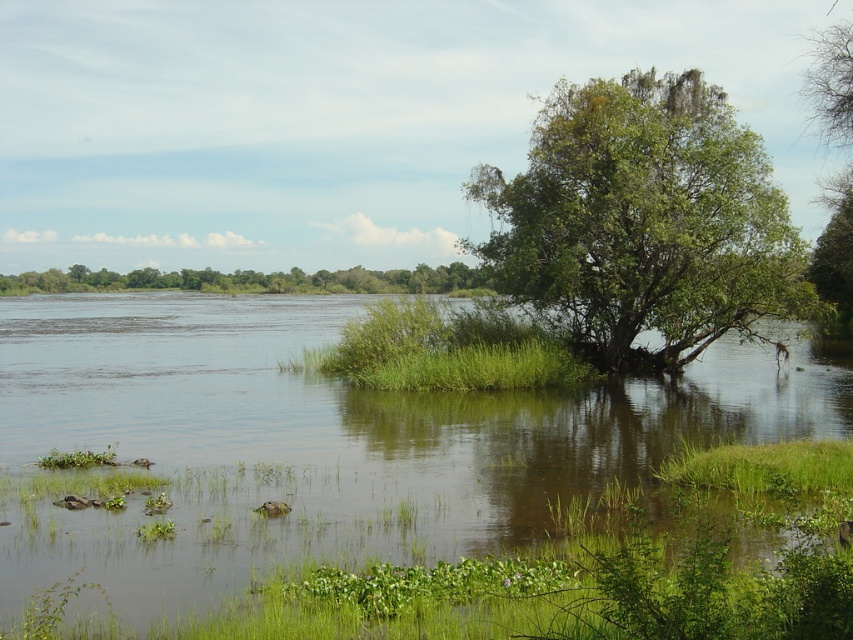
Question: Can you confirm if green leafy tree at upper right is positioned below green leafy tree at center?

Choices:
 (A) yes
 (B) no

Answer: (A)

Question: Estimate the real-world distances between objects in this image. Which object is farther from the green leafy tree at upper right?

Choices:
 (A) green grassy river at center
 (B) green leafy tree at center

Answer: (B)

Question: Which point is farther to the camera?

Choices:
 (A) (643, 269)
 (B) (424, 291)
 (C) (843, 401)

Answer: (B)

Question: Is green grassy river at center thinner than green leafy tree at upper right?

Choices:
 (A) yes
 (B) no

Answer: (B)

Question: Which object appears farthest from the camera in this image?

Choices:
 (A) green grassy river at center
 (B) green leafy tree at center

Answer: (B)

Question: Is green grassy river at center to the right of green leafy tree at center from the viewer's perspective?

Choices:
 (A) no
 (B) yes

Answer: (B)